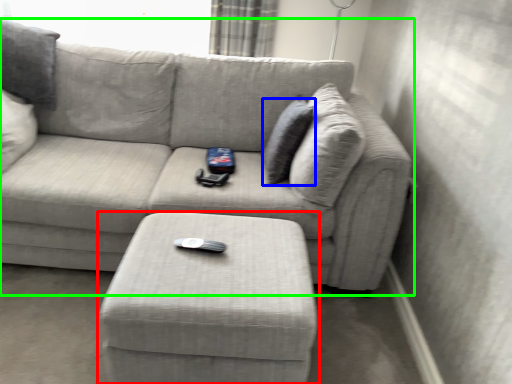
Question: Which object is positioned closest to table (highlighted by a red box)? Select from pillow (highlighted by a blue box) and studio couch (highlighted by a green box).

Choices:
 (A) pillow
 (B) studio couch

Answer: (B)